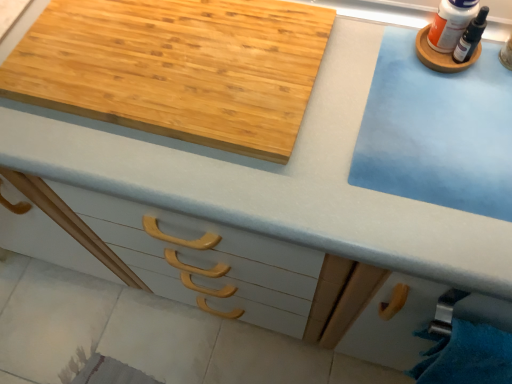
The width and height of the screenshot is (512, 384). What do you see at coordinates (177, 68) in the screenshot?
I see `natural wood cutting board at upper left` at bounding box center [177, 68].

Image resolution: width=512 pixels, height=384 pixels. Find the location of `natural wood cutting board at upper left`. natural wood cutting board at upper left is located at coordinates (177, 68).

In the scene shown: In order to face natural wood cutting board at upper left, should I rotate leftwards or rightwards?

Rotate left and turn 11.891 degrees.

The width and height of the screenshot is (512, 384). Find the location of `natural wood cutting board at upper left`. natural wood cutting board at upper left is located at coordinates (177, 68).